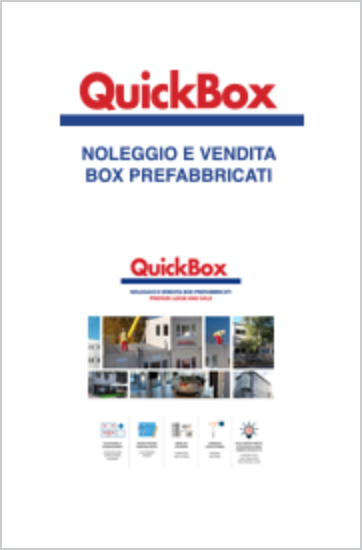
This screenshot has height=550, width=362. Find the location of `light bulb`. light bulb is located at coordinates click(x=249, y=429).